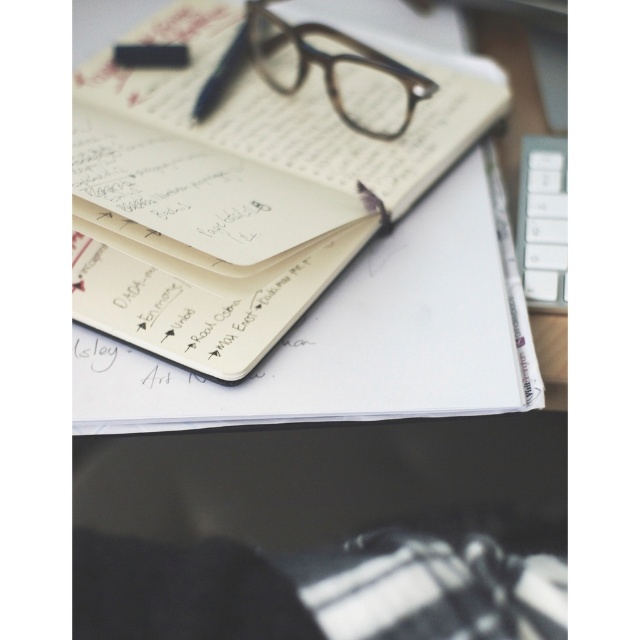
You are a photographer adjusting the focus on your camera. You have two points in your viewfinder labeled as point (x=444, y=125) and point (x=563, y=209). If you want to focus on the point closer to the camera, which point should you choose?

Point (x=444, y=125) is further to the camera than point (x=563, y=209), so you should focus on point (x=444, y=125) to capture the closer object.

You are a photographer standing at a certain distance from the matte paper notebook at center. You want to take a clear photo of it without any blur. The camera you are using has a minimum focusing distance of 3.5 feet. Can you take the photo without moving closer?

The matte paper notebook at center is 3.49 feet away from the camera. Since the minimum focusing distance is 3.5 feet, the notebook is slightly closer than required, so the camera cannot focus properly. You need to move back or adjust the settings to capture a clear photo.